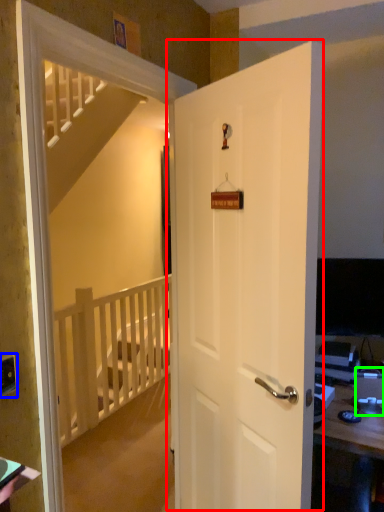
Question: Considering the real-world distances, which object is closest to door (highlighted by a red box)? electric outlet (highlighted by a blue box) or desktop computer (highlighted by a green box).

Choices:
 (A) electric outlet
 (B) desktop computer

Answer: (B)